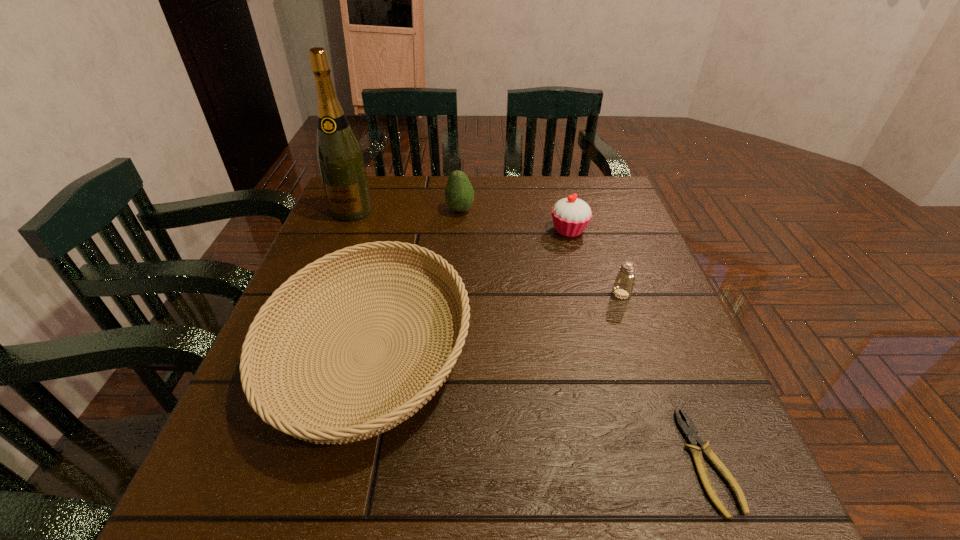
The width and height of the screenshot is (960, 540). Find the location of `wine bottle`. wine bottle is located at coordinates (339, 156).

At what (x,y) coordinates should I click in order to perform the action: click on avocado. Please return your answer as a coordinate pair (x, y). Image resolution: width=960 pixels, height=540 pixels. Looking at the image, I should click on [x=459, y=195].

I want to click on cupcake, so click(571, 215).

Image resolution: width=960 pixels, height=540 pixels. What are the coordinates of `basket` in the screenshot? It's located at (368, 423).

This screenshot has height=540, width=960. Identify the location of saltshaker. (623, 286).

The width and height of the screenshot is (960, 540). In order to click on pliers in this screenshot , I will do `click(691, 434)`.

The image size is (960, 540). I want to click on vacant space located on the front-facing side of the tallest object, so click(305, 325).

Locate an element on the screen. Image resolution: width=960 pixels, height=540 pixels. vacant space positioned on the front of the avocado is located at coordinates (458, 248).

This screenshot has height=540, width=960. Identify the location of vacant space located on the left of the cupcake. (501, 230).

You are a GUI agent. You are given a task and a screenshot of the screen. Output one action in this format:
    pyautogui.click(x=<x>, y=<y>)
    Task: Click on the free location located on the right of the basket
    
    Given the screenshot: What is the action you would take?
    click(x=503, y=350)